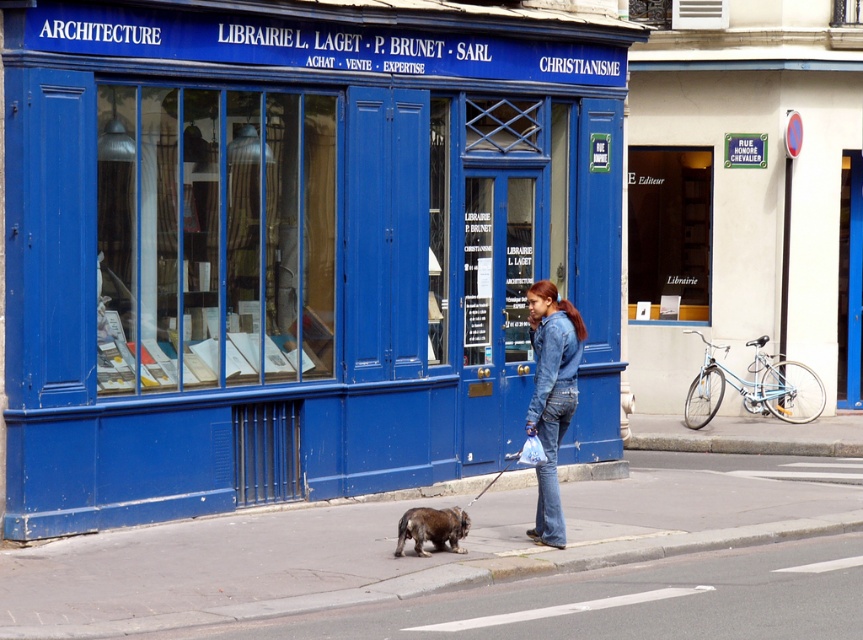
Which is below, smooth concrete sidewalk at center or brown fur dog at center?

smooth concrete sidewalk at center is lower down.

Can you confirm if smooth concrete sidewalk at center is positioned to the right of brown fur dog at center?

No, smooth concrete sidewalk at center is not to the right of brown fur dog at center.

Who is more forward, (104, 609) or (444, 538)?

Point (104, 609)

The height and width of the screenshot is (640, 863). In order to click on smooth concrete sidewalk at center in this screenshot , I will do `click(392, 548)`.

Who is taller, blue painted building at center or brown fur dog at center?

blue painted building at center is taller.

Does blue painted building at center appear on the left side of brown fur dog at center?

Correct, you'll find blue painted building at center to the left of brown fur dog at center.

From the picture: Who is more distant from viewer, (120, 204) or (445, 513)?

Point (120, 204)

Locate an element on the screen. blue painted building at center is located at coordinates (293, 244).

Can you confirm if blue painted building at center is bigger than denim jacket at center?

No, blue painted building at center is not bigger than denim jacket at center.

Can you confirm if blue painted building at center is positioned to the left of denim jacket at center?

Correct, you'll find blue painted building at center to the left of denim jacket at center.

Does point (38, 193) lie in front of point (553, 328)?

Yes, it is.

I want to click on blue painted building at center, so click(293, 244).